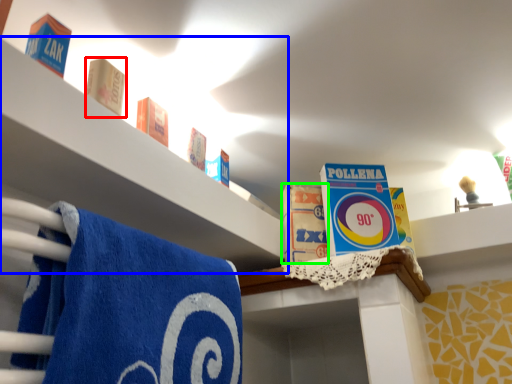
Question: Which object is positioned farthest from product (highlighted by a red box)? Select from shelf (highlighted by a blue box) and product (highlighted by a green box).

Choices:
 (A) shelf
 (B) product

Answer: (B)